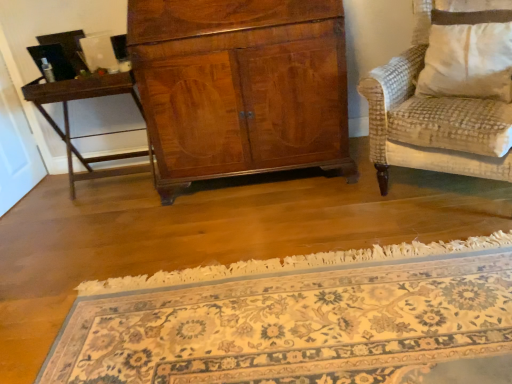
At what (x,y) coordinates should I click in order to perform the action: click on free space above floral carpet at center (from a real-world perspective). Please return your answer as a coordinate pair (x, y). This screenshot has height=384, width=512. Looking at the image, I should click on (225, 260).